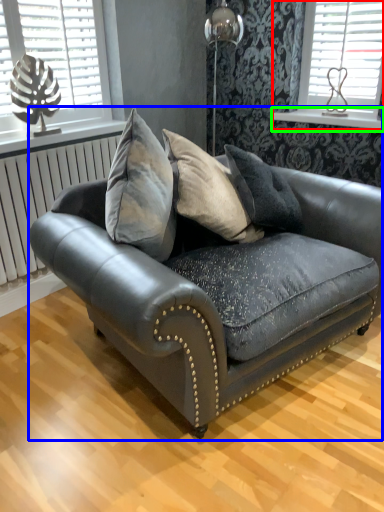
Question: Which object is the closest to the window (highlighted by a red box)? Choose among these: studio couch (highlighted by a blue box) or window sill (highlighted by a green box).

Choices:
 (A) studio couch
 (B) window sill

Answer: (B)